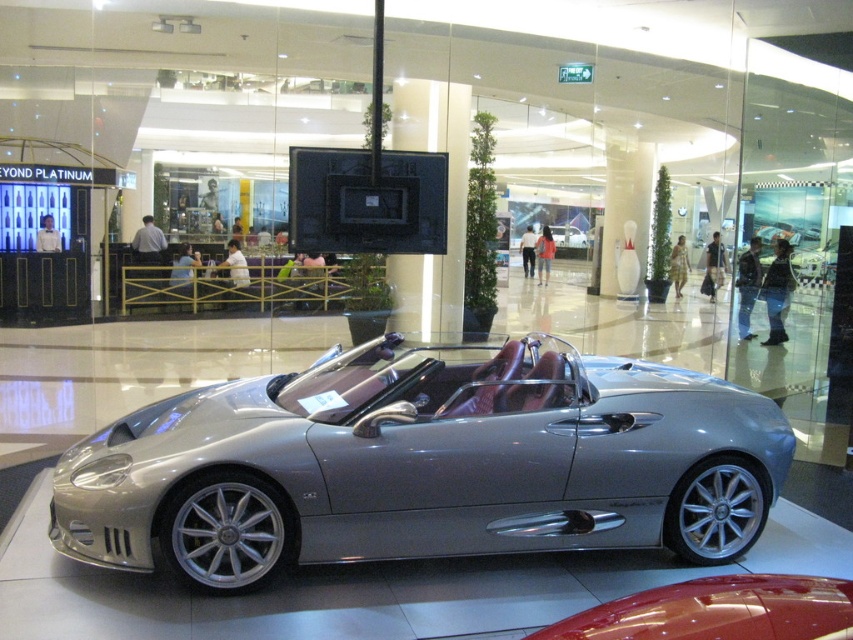
Is point (114, 442) more distant than point (622, 625)?

Yes, it is behind point (622, 625).

Who is higher up, silver metallic convertible at center or glossy red car at lower right?

silver metallic convertible at center is above.

What are the coordinates of `silver metallic convertible at center` in the screenshot? It's located at (424, 465).